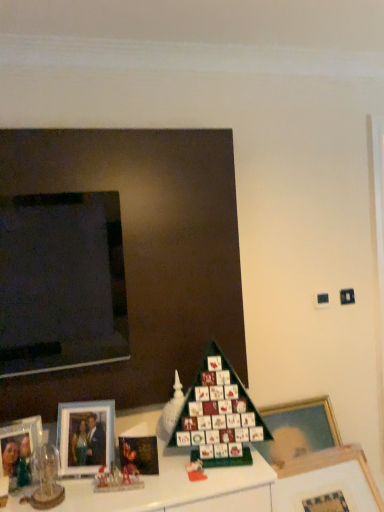
Question: From the image's perspective, does matte plastic toy at lower center appear higher than clear glass photo frame at lower left, which is the fourth picture frame from right to left?

Choices:
 (A) no
 (B) yes

Answer: (A)

Question: Is matte plastic toy at lower center touching clear glass photo frame at lower left, which is the fourth picture frame from right to left?

Choices:
 (A) no
 (B) yes

Answer: (A)

Question: From a real-world perspective, is matte plastic toy at lower center physically above clear glass photo frame at lower left, which is counted as the first picture frame, starting from the left?

Choices:
 (A) no
 (B) yes

Answer: (A)

Question: Considering the relative sizes of matte plastic toy at lower center and clear glass photo frame at lower left, which is counted as the first picture frame, starting from the left, in the image provided, is matte plastic toy at lower center thinner than clear glass photo frame at lower left, which is counted as the first picture frame, starting from the left,?

Choices:
 (A) yes
 (B) no

Answer: (B)

Question: Is the depth of matte plastic toy at lower center greater than that of clear glass photo frame at lower left, which is the fourth picture frame from right to left?

Choices:
 (A) yes
 (B) no

Answer: (A)

Question: Do you think wooden picture frame at lower right, which ranks as the 4th picture frame in left-to-right order, is within matte silver picture frame at lower left, the third picture frame positioned from the right, or outside of it?

Choices:
 (A) outside
 (B) inside

Answer: (A)

Question: Based on their sizes in the image, would you say wooden picture frame at lower right, which ranks as the 4th picture frame in left-to-right order, is bigger or smaller than matte silver picture frame at lower left, the second picture frame when ordered from left to right?

Choices:
 (A) small
 (B) big

Answer: (B)

Question: From their relative heights in the image, would you say wooden picture frame at lower right, the first picture frame in the right-to-left sequence, is taller or shorter than matte silver picture frame at lower left, the third picture frame positioned from the right?

Choices:
 (A) tall
 (B) short

Answer: (A)

Question: Visually, is wooden picture frame at lower right, the first picture frame in the right-to-left sequence, positioned to the left or to the right of matte silver picture frame at lower left, the third picture frame positioned from the right?

Choices:
 (A) right
 (B) left

Answer: (A)

Question: Is matte silver picture frame at lower left, the second picture frame when ordered from left to right, inside the boundaries of green cardboard christmas tree at center, or outside?

Choices:
 (A) inside
 (B) outside

Answer: (B)

Question: Is matte silver picture frame at lower left, the second picture frame when ordered from left to right, bigger or smaller than green cardboard christmas tree at center?

Choices:
 (A) big
 (B) small

Answer: (B)

Question: Looking at their shapes, would you say matte silver picture frame at lower left, the third picture frame positioned from the right, is wider or thinner than green cardboard christmas tree at center?

Choices:
 (A) thin
 (B) wide

Answer: (A)

Question: Is matte silver picture frame at lower left, the third picture frame positioned from the right, to the left or to the right of green cardboard christmas tree at center in the image?

Choices:
 (A) left
 (B) right

Answer: (A)

Question: Considering the positions of matte silver picture frame at lower left, the second picture frame when ordered from left to right, and matte black picture frame at lower left, placed as the 3th picture frame when sorted from left to right, in the image, is matte silver picture frame at lower left, the second picture frame when ordered from left to right, taller or shorter than matte black picture frame at lower left, placed as the 3th picture frame when sorted from left to right,?

Choices:
 (A) tall
 (B) short

Answer: (A)

Question: Considering the relative positions of matte silver picture frame at lower left, the third picture frame positioned from the right, and matte black picture frame at lower left, acting as the 2th picture frame starting from the right, in the image provided, is matte silver picture frame at lower left, the third picture frame positioned from the right, to the left or to the right of matte black picture frame at lower left, acting as the 2th picture frame starting from the right,?

Choices:
 (A) left
 (B) right

Answer: (A)